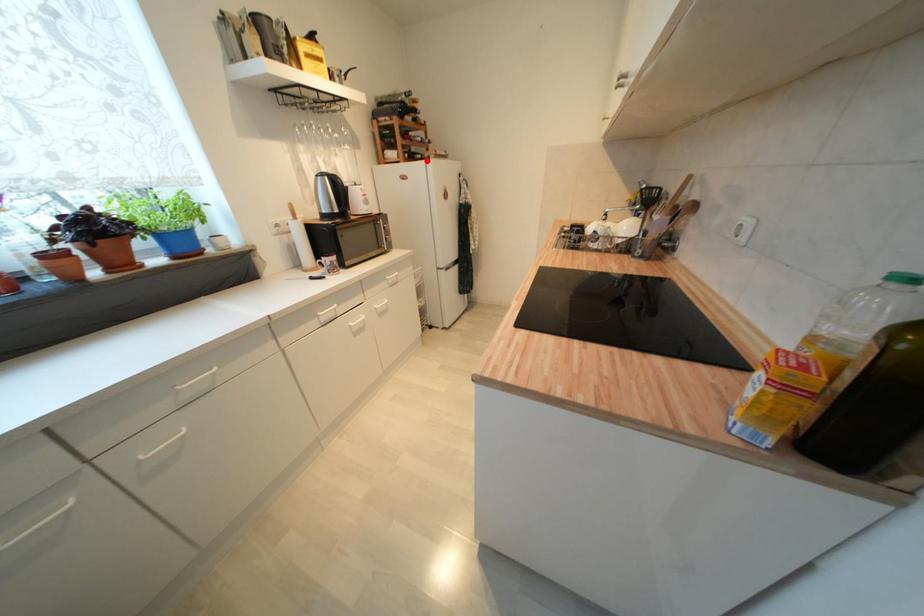
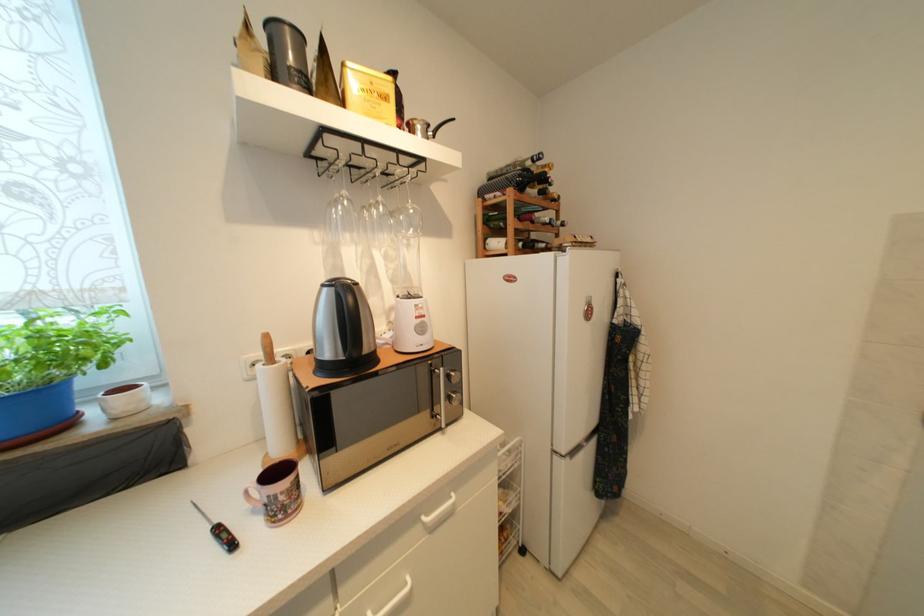
Question: I am providing you with two images of the same scene from different viewpoints. A red point is shown in image1. For the corresponding object point in image2, is it positioned nearer or farther from the camera?

Choices:
 (A) Nearer
 (B) Farther

Answer: (B)